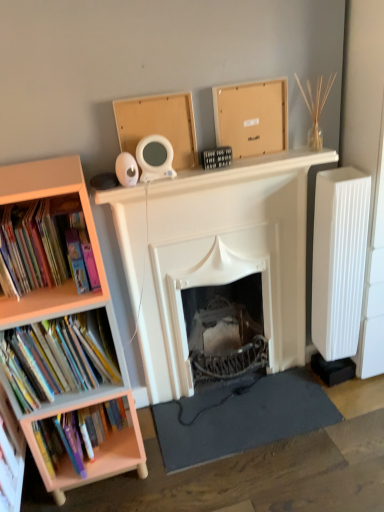
Find the location of a particular element. The image size is (384, 512). vacant region in front of matte cardboard box at upper center, arranged as the 1th cardboard box when viewed from the right is located at coordinates (247, 160).